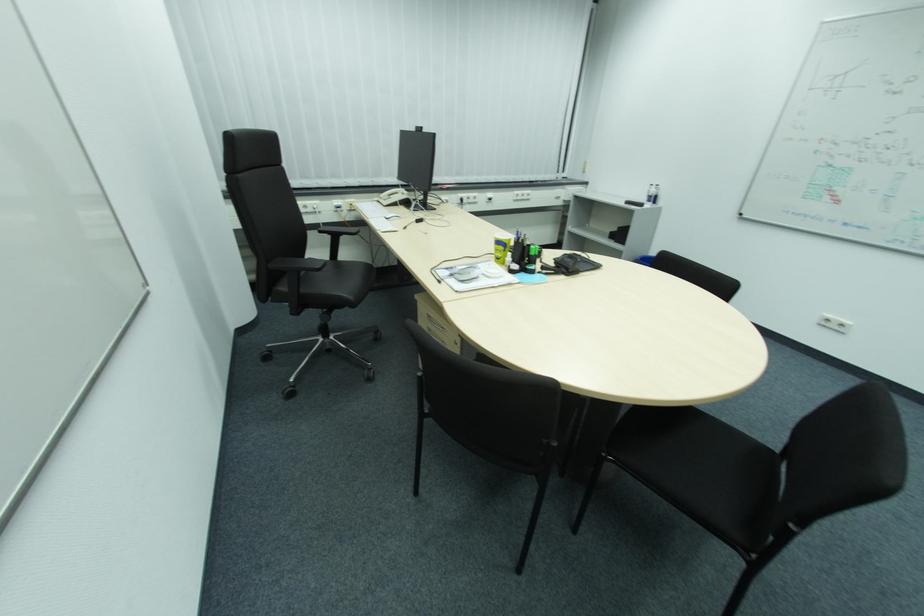
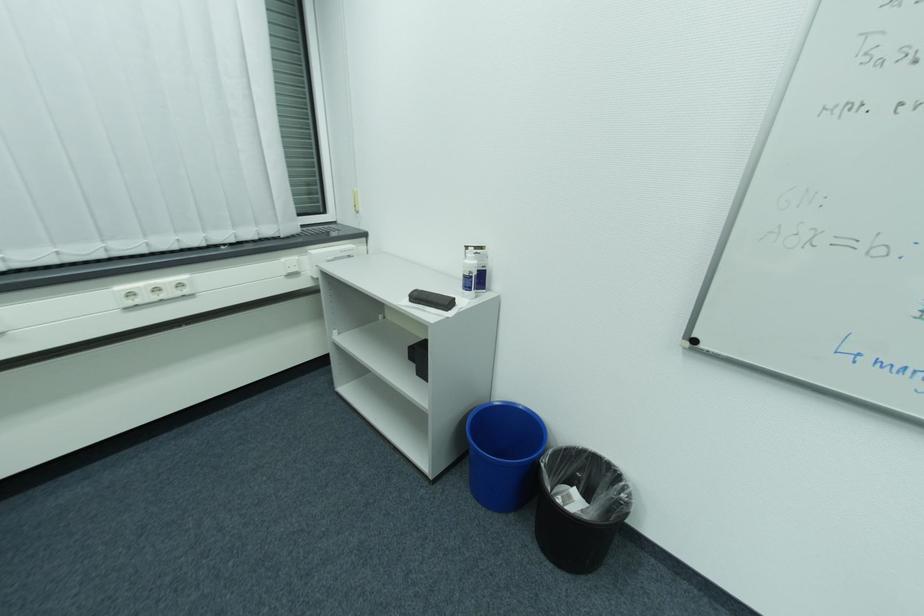
Which direction would the cameraman need to move to produce the second image?

The cameraman walked toward right, forward.